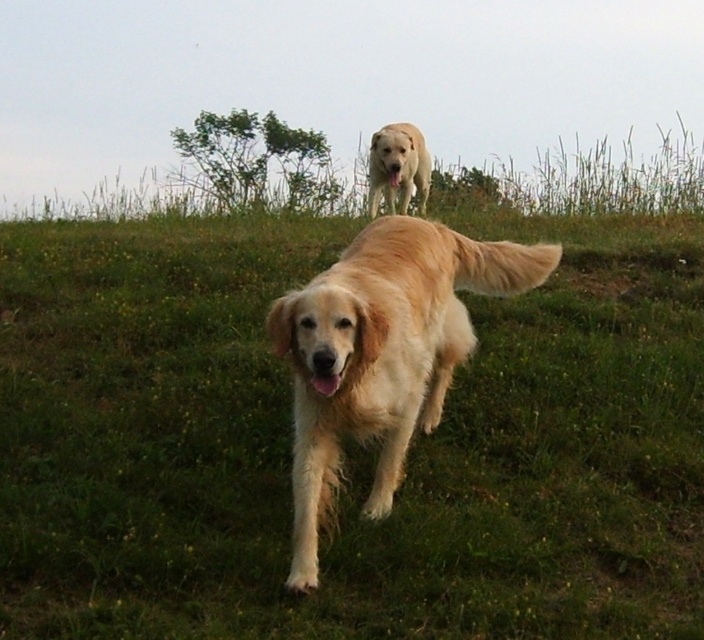
You are a photographer trying to capture a clear photo of both golden retrievers. Since the golden soft fur dog at center is in front of the golden fur dog at upper center, will the background dog be partially obscured?

Yes, the golden soft fur dog at center is in front of the golden fur dog at upper center, so the background dog will be partially obscured.

You are a dog trainer observing two golden retrievers in a grassy area. You see the golden soft fur dog at center and the golden fur dog at upper center. Which dog would cast a longer shadow if the sun is directly overhead?

The golden soft fur dog at center is much taller than the golden fur dog at upper center, so it would cast a longer shadow.